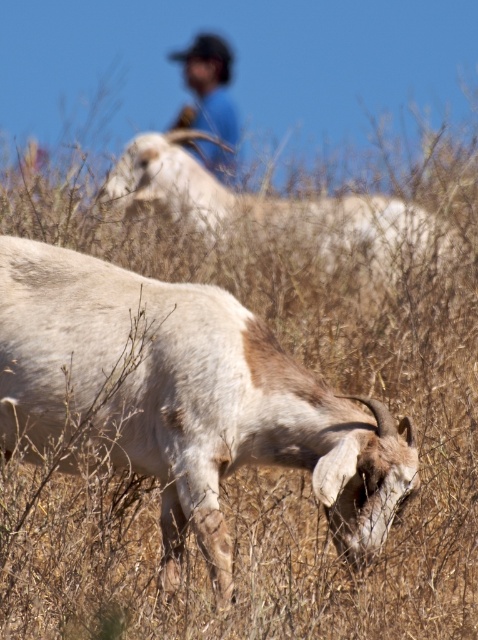
Between white woolen goat at lower center and white woolen goat at upper center, which one is positioned lower?

white woolen goat at lower center

Is white woolen goat at lower center further to camera compared to white woolen goat at upper center?

No, white woolen goat at lower center is in front of white woolen goat at upper center.

Consider the image. Who is more forward, (236, 344) or (206, 227)?

Point (236, 344) is more forward.

The image size is (478, 640). What are the coordinates of `white woolen goat at lower center` in the screenshot? It's located at (189, 397).

Who is taller, white woolen goat at upper center or blue cotton shirt at upper center?

white woolen goat at upper center

Does white woolen goat at upper center appear on the left side of blue cotton shirt at upper center?

No, white woolen goat at upper center is not to the left of blue cotton shirt at upper center.

In order to click on white woolen goat at upper center in this screenshot , I will do `click(276, 208)`.

This screenshot has height=640, width=478. I want to click on white woolen goat at upper center, so click(276, 208).

Who is lower down, white woolen goat at lower center or blue cotton shirt at upper center?

white woolen goat at lower center is lower down.

Locate an element on the screen. This screenshot has width=478, height=640. white woolen goat at lower center is located at coordinates (189, 397).

Which is behind, point (41, 321) or point (223, 74)?

The point (223, 74) is behind.

Identify the location of white woolen goat at lower center. This screenshot has width=478, height=640. (189, 397).